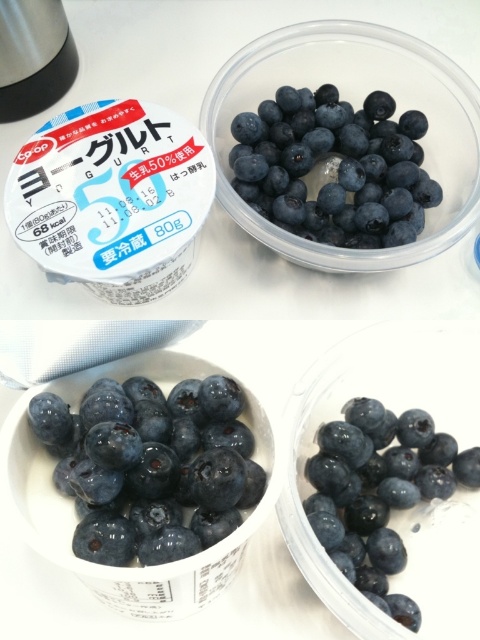
Where is the glossy blueberry at center located in the image?

The glossy blueberry at center is located at point (151,465).

You are a food delivery robot that needs to pick up two blueberries from the containers on the table. The robot has a 6.5 inch wide arm. Can the robot pick up both the glossy blueberry at center and the shiny blueberry at center at the same time?

The glossy blueberry at center and the shiny blueberry at center are 6.94 inches apart from each other. Since the robot arm is only 6.5 inches wide, it cannot reach both blueberries simultaneously because the distance between them exceeds the arm width.